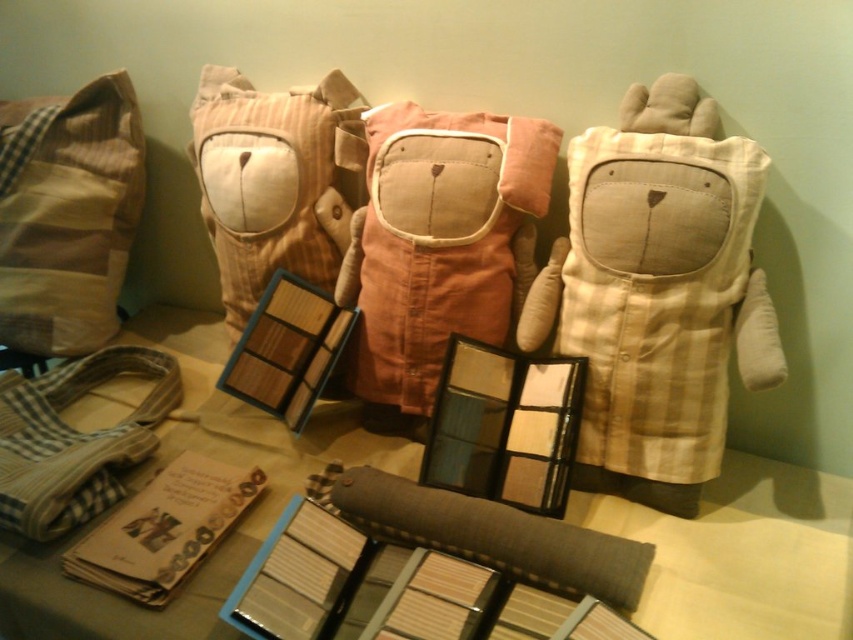
Where is the striped fabric pillow at center located in the image?

The striped fabric pillow at center is located at point (270, 180).

You are organizing a textile exhibition and need to arrange the brown plaid pillow at left and the checkered fabric bag at lower left on a shelf. Which item requires more shelf space?

The checkered fabric bag at lower left requires more shelf space because the brown plaid pillow at left occupies less space than it.

You are looking at the two points labeled point (296,122) and point (486,540) in the image. Which point is closer to you?

Point (296,122) is closer to you because it is further to the camera than point (486,540).